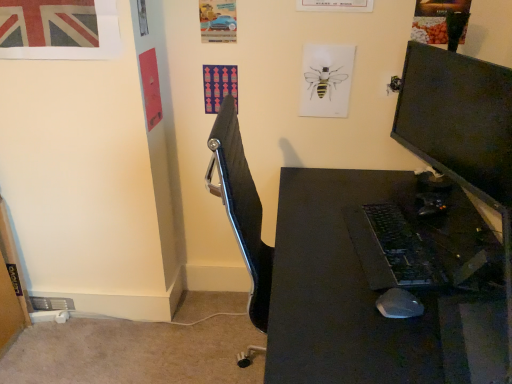
Where is `vacant space situated on the left part of black plastic keyboard at center-right`? The image size is (512, 384). vacant space situated on the left part of black plastic keyboard at center-right is located at coordinates (311, 249).